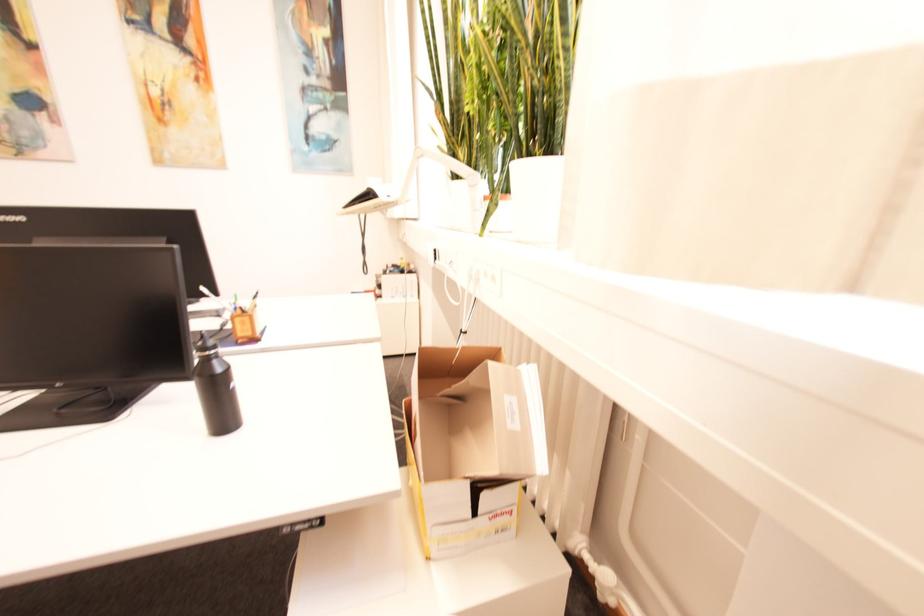
Where would you lift the stack of papers? Please return your answer as a coordinate pair (x, y).

(210, 315)